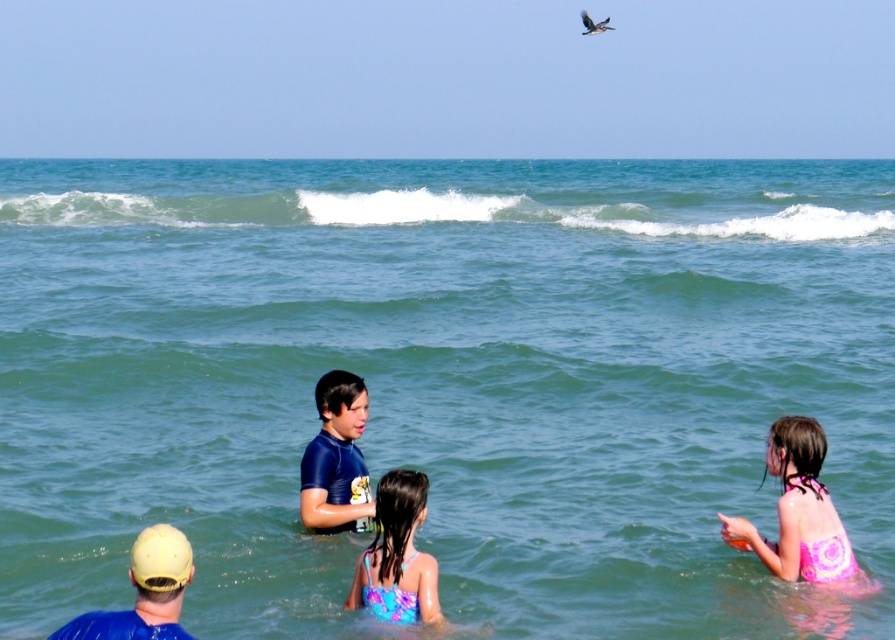
Is the position of blue wetsuit at center less distant than that of blue fabric cap at lower left?

No, it is behind blue fabric cap at lower left.

Is point (320, 456) positioned before point (124, 616)?

No, it is not.

Locate an element on the screen. The height and width of the screenshot is (640, 895). blue wetsuit at center is located at coordinates (337, 458).

Can you confirm if multicolored swimsuit at center is thinner than blue fabric cap at lower left?

Yes.

Is point (423, 616) in front of point (61, 630)?

No.

Where is `multicolored swimsuit at center`? This screenshot has height=640, width=895. multicolored swimsuit at center is located at coordinates (397, 556).

Does point (789, 561) come closer to viewer compared to point (62, 632)?

No.

Is pink floral swimsuit at lower right closer to camera compared to blue fabric cap at lower left?

No, pink floral swimsuit at lower right is behind blue fabric cap at lower left.

Does point (804, 552) lie in front of point (143, 552)?

That is False.

Where is `pink floral swimsuit at lower right`? Image resolution: width=895 pixels, height=640 pixels. pink floral swimsuit at lower right is located at coordinates (797, 509).